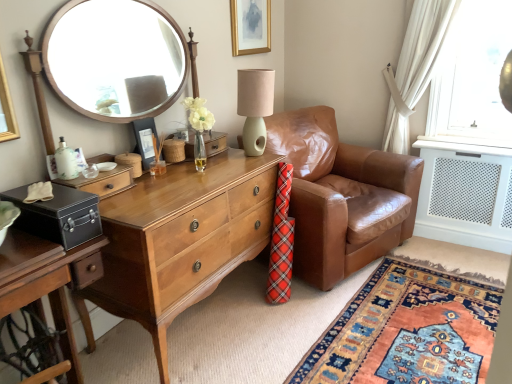
Locate an element on the screen. The width and height of the screenshot is (512, 384). vacant space underneath mint green ceramic table lamp at center (from a real-world perspective) is located at coordinates [253, 155].